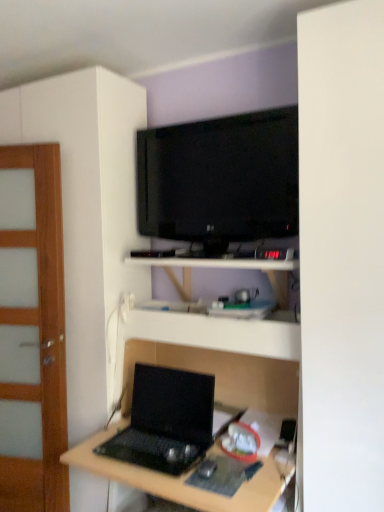
The height and width of the screenshot is (512, 384). What do you see at coordinates (32, 331) in the screenshot?
I see `wooden door at left` at bounding box center [32, 331].

Describe the element at coordinates (220, 179) in the screenshot. The image size is (384, 512). I see `black glossy tv at upper center` at that location.

What do you see at coordinates (219, 333) in the screenshot? I see `white matte shelf at center` at bounding box center [219, 333].

In order to face black plastic mouse at lower center, should I rotate leftwards or rightwards?

You should rotate right by 2.223 degrees.

What do you see at coordinates (166, 421) in the screenshot? This screenshot has height=512, width=384. I see `black matte laptop at lower center` at bounding box center [166, 421].

The width and height of the screenshot is (384, 512). I want to click on wooden door at left, so click(32, 331).

Is white matte shelf at center to the left of black plastic mouse at lower center from the viewer's perspective?

No.

Are white matte shelf at center and black plastic mouse at lower center far apart?

That's not correct — white matte shelf at center is a little close to black plastic mouse at lower center.

From a real-world perspective, who is located higher, white matte shelf at center or black plastic mouse at lower center?

white matte shelf at center is physically above.

Considering the sizes of white matte shelf at center and black plastic mouse at lower center in the image, is white matte shelf at center bigger or smaller than black plastic mouse at lower center?

Clearly, white matte shelf at center is larger in size than black plastic mouse at lower center.

Does white matte shelf at center appear on the left side of black glossy tv at upper center?

In fact, white matte shelf at center is to the right of black glossy tv at upper center.

Is white matte shelf at center turned away from black glossy tv at upper center?

No, black glossy tv at upper center is not at the back of white matte shelf at center.

Consider the image. Between white matte shelf at center and black glossy tv at upper center, which one has less height?

white matte shelf at center.

Between black matte laptop at lower center and black glossy tv at upper center, which one has smaller width?

Thinner between the two is black glossy tv at upper center.

Does point (133, 456) appear closer or farther from the camera than point (199, 166)?

Point (133, 456) is closer to the camera than point (199, 166).

Considering the relative sizes of black matte laptop at lower center and black glossy tv at upper center in the image provided, is black matte laptop at lower center taller than black glossy tv at upper center?

In fact, black matte laptop at lower center may be shorter than black glossy tv at upper center.

From a real-world perspective, is black matte laptop at lower center below black glossy tv at upper center?

Yes, from a real-world perspective, black matte laptop at lower center is beneath black glossy tv at upper center.

Does point (130, 315) appear closer or farther from the camera than point (60, 428)?

Point (130, 315) is closer to the camera than point (60, 428).

Is matte black laptop at center wider or thinner than wooden door at left?

Considering their sizes, matte black laptop at center looks broader than wooden door at left.

From a real-world perspective, who is located higher, matte black laptop at center or wooden door at left?

wooden door at left is physically above.

Is matte black laptop at center at the right side of wooden door at left?

Correct, you'll find matte black laptop at center to the right of wooden door at left.

Between black plastic mouse at lower center and black matte laptop at lower center, which one has less height?

Standing shorter between the two is black plastic mouse at lower center.

You are a GUI agent. You are given a task and a screenshot of the screen. Output one action in this format:
    pyautogui.click(x=<x>, y=<y>)
    Task: Click on the mouse on the right of black matte laptop at lower center
    
    Given the screenshot: What is the action you would take?
    pyautogui.click(x=207, y=468)

Could you tell me if black plastic mouse at lower center is turned towards black matte laptop at lower center?

No, black plastic mouse at lower center is not turned towards black matte laptop at lower center.

Measure the distance between black plastic mouse at lower center and black matte laptop at lower center.

A distance of 27.57 centimeters exists between black plastic mouse at lower center and black matte laptop at lower center.

Which is in front, white matte shelf at center or matte black laptop at center?

Positioned in front is matte black laptop at center.

From the image's perspective, between white matte shelf at center and matte black laptop at center, which one is located above?

white matte shelf at center.

In terms of width, does white matte shelf at center look wider or thinner when compared to matte black laptop at center?

Clearly, white matte shelf at center has less width compared to matte black laptop at center.

Can matte black laptop at center be found inside white matte shelf at center?

Actually, matte black laptop at center is outside white matte shelf at center.

Considering the relative sizes of black plastic mouse at lower center and black glossy tv at upper center in the image provided, is black plastic mouse at lower center thinner than black glossy tv at upper center?

In fact, black plastic mouse at lower center might be wider than black glossy tv at upper center.

Is there a large distance between black plastic mouse at lower center and black glossy tv at upper center?

Indeed, black plastic mouse at lower center is not near black glossy tv at upper center.

Considering the relative positions of black plastic mouse at lower center and black glossy tv at upper center in the image provided, is black plastic mouse at lower center to the left or to the right of black glossy tv at upper center?

Based on their positions, black plastic mouse at lower center is located to the left of black glossy tv at upper center.

Which of these two, black plastic mouse at lower center or black glossy tv at upper center, stands taller?

black glossy tv at upper center.

Where is `mouse below the white matte shelf at center (from the image's perspective)`? This screenshot has height=512, width=384. mouse below the white matte shelf at center (from the image's perspective) is located at coordinates (207, 468).

Locate an element on the screen. shelf below the black glossy tv at upper center (from a real-world perspective) is located at coordinates (219, 333).

Which object lies further to the anchor point black plastic mouse at lower center, black matte laptop at lower center or white matte shelf at center?

The object further to black plastic mouse at lower center is white matte shelf at center.

Considering their positions, is black matte laptop at lower center positioned further to matte black laptop at center than wooden door at left?

wooden door at left.

When comparing their distances from black matte laptop at lower center, does black plastic mouse at lower center or matte black laptop at center seem further?

black plastic mouse at lower center.

Estimate the real-world distances between objects in this image. Which object is further from black matte laptop at lower center, matte black laptop at center or black glossy tv at upper center?

black glossy tv at upper center.

When comparing their distances from matte black laptop at center, does black matte laptop at lower center or black plastic mouse at lower center seem further?

black plastic mouse at lower center lies further to matte black laptop at center than the other object.

When comparing their distances from black glossy tv at upper center, does black matte laptop at lower center or wooden door at left seem closer?

wooden door at left is closer to black glossy tv at upper center.

When comparing their distances from matte black laptop at center, does wooden door at left or black plastic mouse at lower center seem closer?

Based on the image, black plastic mouse at lower center appears to be nearer to matte black laptop at center.

Which object lies further to the anchor point black matte laptop at lower center, white matte shelf at center or black plastic mouse at lower center?

white matte shelf at center lies further to black matte laptop at lower center than the other object.

The width and height of the screenshot is (384, 512). I want to click on mouse between white matte shelf at center and matte black laptop at center vertically, so click(207, 468).

Identify the location of shelf between black glossy tv at upper center and black plastic mouse at lower center from top to bottom. (219, 333).

Where is `door that lies between black glossy tv at upper center and black plastic mouse at lower center from top to bottom`? The width and height of the screenshot is (384, 512). door that lies between black glossy tv at upper center and black plastic mouse at lower center from top to bottom is located at coordinates (32, 331).

Identify the location of mouse located between wooden door at left and white matte shelf at center in the left-right direction. This screenshot has width=384, height=512. (207, 468).